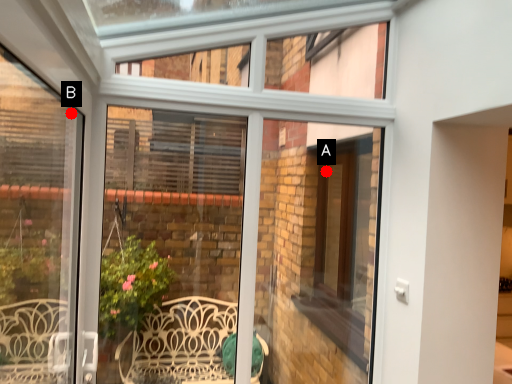
Question: Two points are circled on the image, labeled by A and B beside each circle. Which point is closer to the camera?

Choices:
 (A) A is closer
 (B) B is closer

Answer: (B)